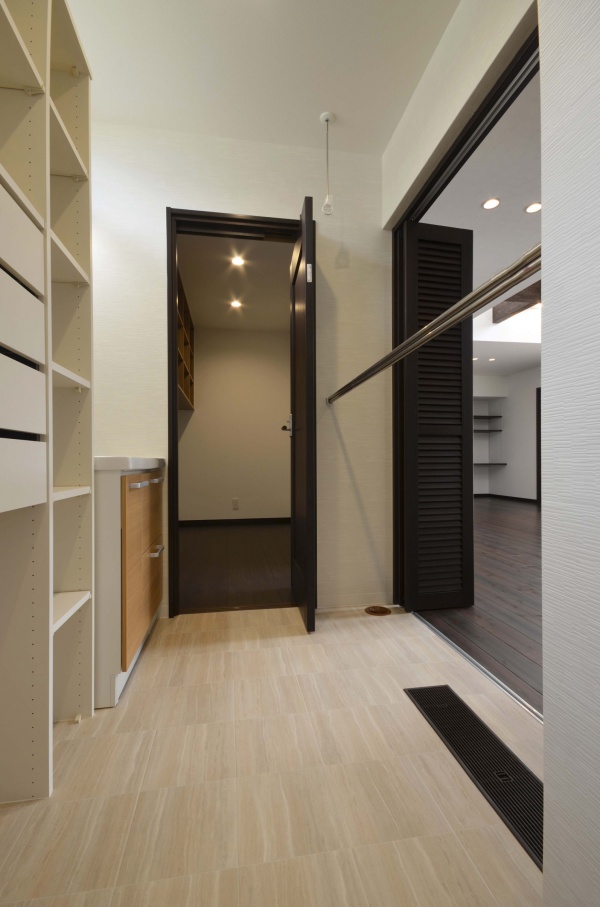
Identify the location of electrical outlet. (234, 504).